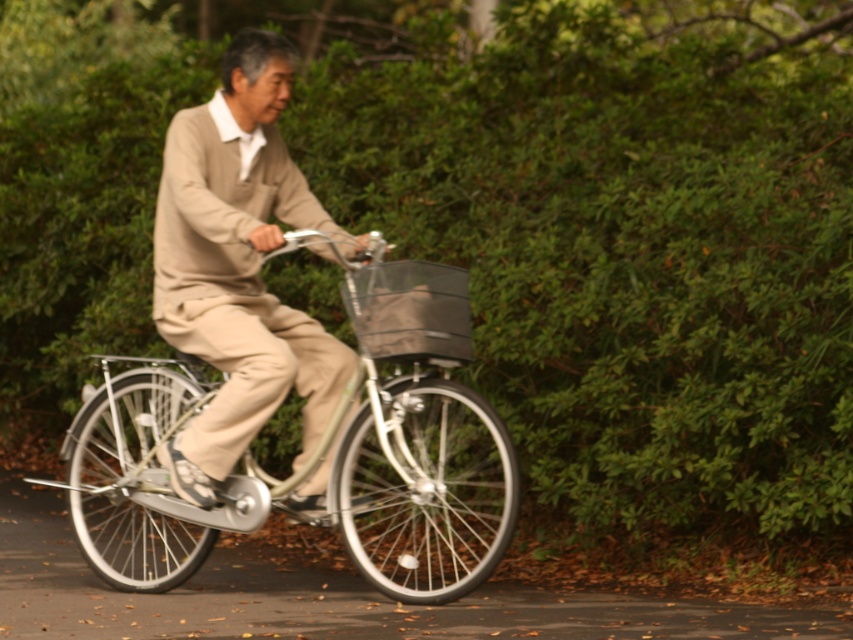
Does silver metallic bicycle at center lie behind matte gray fabric basket at center?

No, silver metallic bicycle at center is closer to the viewer.

In the scene shown: Does silver metallic bicycle at center appear over matte gray fabric basket at center?

No.

Is point (422, 328) positioned behind point (410, 296)?

No, it is not.

The width and height of the screenshot is (853, 640). What are the coordinates of `silver metallic bicycle at center` in the screenshot? It's located at (315, 454).

Is beige wool sweater at center to the right of matte gray fabric basket at center from the viewer's perspective?

In fact, beige wool sweater at center is to the left of matte gray fabric basket at center.

Does beige wool sweater at center have a larger size compared to matte gray fabric basket at center?

Correct, beige wool sweater at center is larger in size than matte gray fabric basket at center.

Between point (279, 349) and point (461, 307), which one is positioned in front?

Point (461, 307) is in front.

Identify the location of beige wool sweater at center. The height and width of the screenshot is (640, 853). (239, 266).

Does silver metallic bicycle at center appear on the left side of beige wool sweater at center?

Yes, silver metallic bicycle at center is to the left of beige wool sweater at center.

Between silver metallic bicycle at center and beige wool sweater at center, which one has less height?

Standing shorter between the two is silver metallic bicycle at center.

Identify the location of silver metallic bicycle at center. (315, 454).